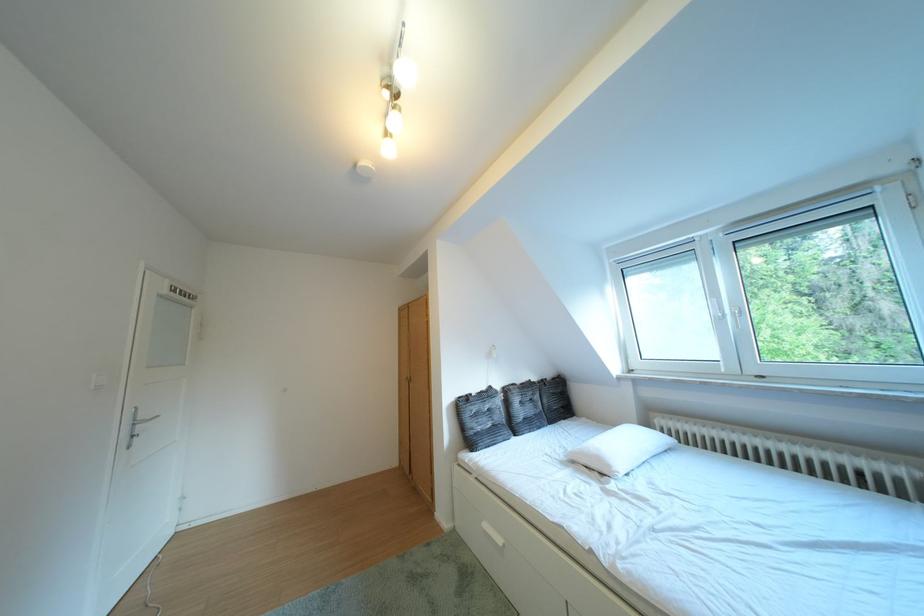
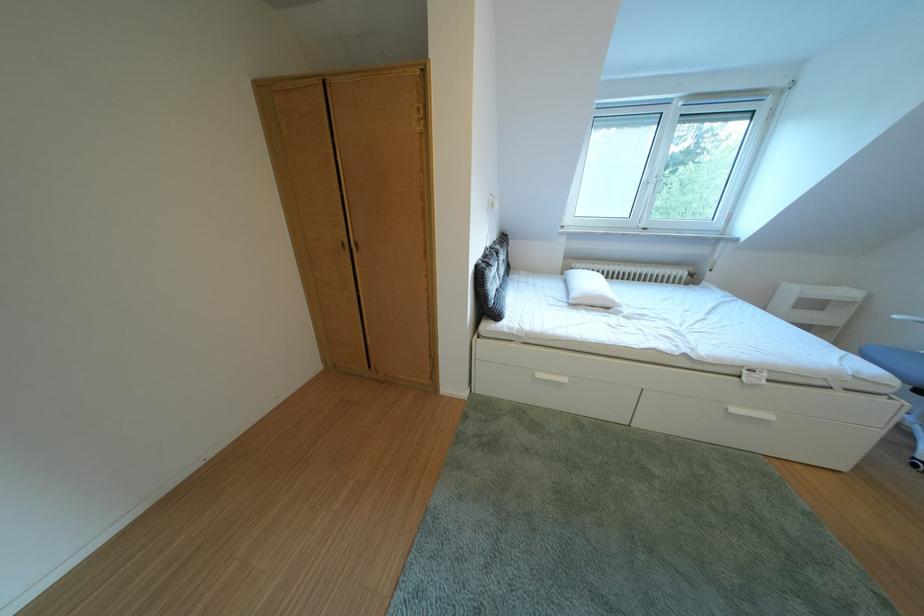
Where in the second image is the point corresponding to pixel 499 531 from the first image?

(553, 381)